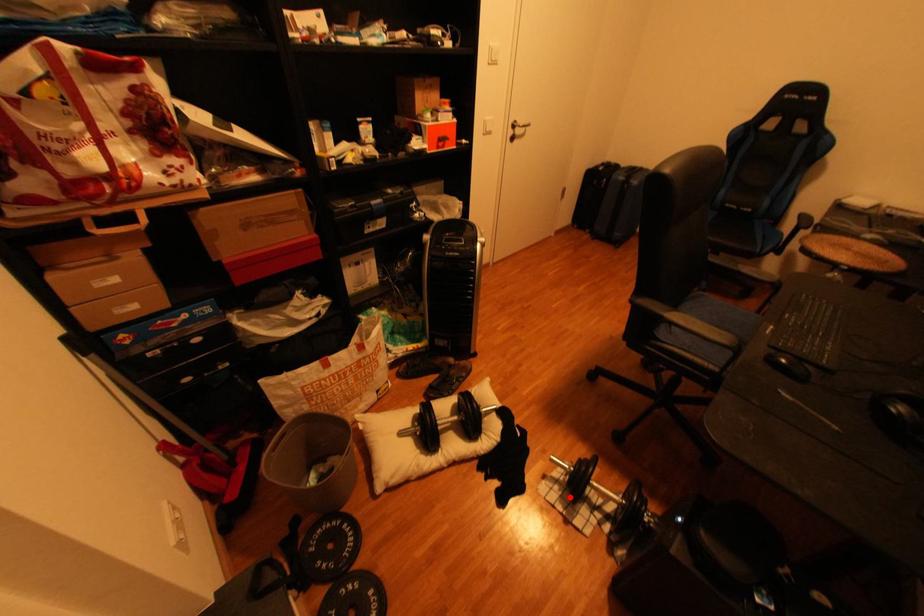
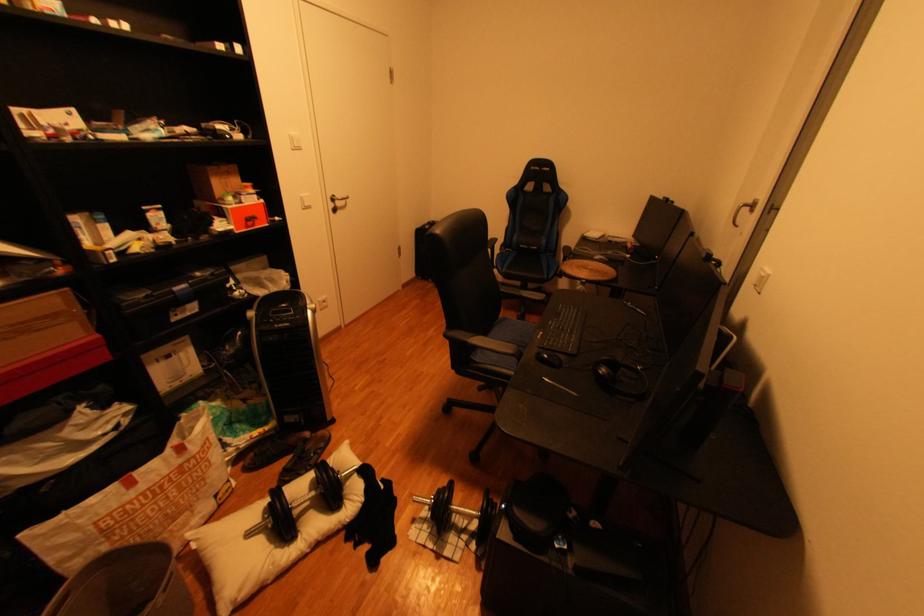
Where in the second image is the point corresponding to the highlighted location from the first image?

(440, 533)